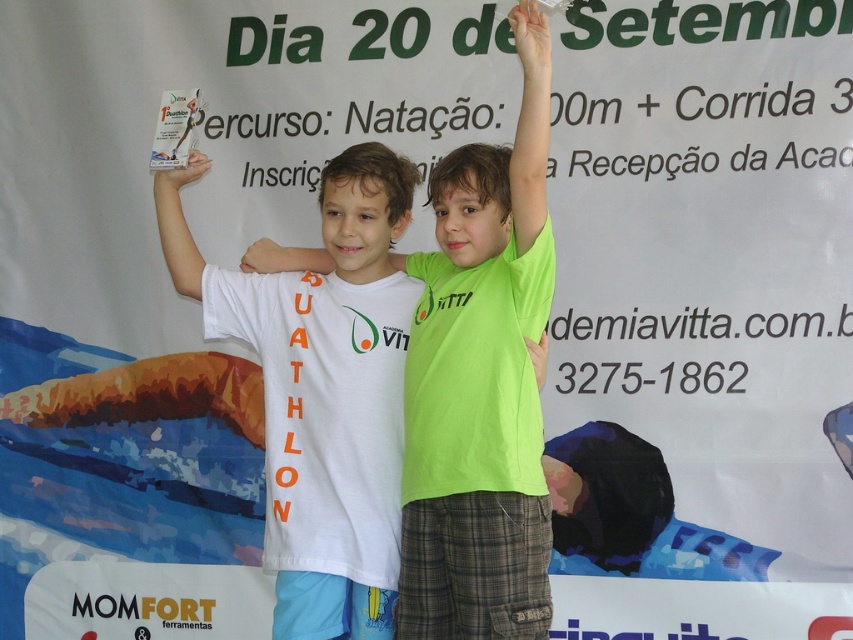
Between green matte shirt at upper right and matte white hand at upper center, which one is positioned lower?

Positioned lower is green matte shirt at upper right.

In the scene shown: Can you confirm if green matte shirt at upper right is positioned to the right of matte white hand at upper center?

No, green matte shirt at upper right is not to the right of matte white hand at upper center.

Which is in front, point (517, 214) or point (508, 19)?

Point (517, 214)

At what (x,y) coordinates should I click in order to perform the action: click on green matte shirt at upper right. Please return your answer as a coordinate pair (x, y). This screenshot has height=640, width=853. Looking at the image, I should click on point(531,124).

From the picture: Who is positioned more to the left, white matte paper at upper left or green fabric arm at center?

Positioned to the left is white matte paper at upper left.

Does white matte paper at upper left have a greater width compared to green fabric arm at center?

Yes, white matte paper at upper left is wider than green fabric arm at center.

You are a GUI agent. You are given a task and a screenshot of the screen. Output one action in this format:
    pyautogui.click(x=<x>, y=<y>)
    Task: Click on the white matte paper at upper left
    
    Given the screenshot: What is the action you would take?
    pyautogui.click(x=178, y=225)

Locate an element on the screen. The height and width of the screenshot is (640, 853). white matte paper at upper left is located at coordinates (178, 225).

Is white cotton t-shirt at center in front of green matte hand at upper center?

Yes, white cotton t-shirt at center is in front of green matte hand at upper center.

Between point (462, 582) and point (541, 352), which one is positioned in front?

Positioned in front is point (462, 582).

Is point (459, 483) positioned after point (540, 385)?

No.

Where is `white cotton t-shirt at center`? white cotton t-shirt at center is located at coordinates (461, 525).